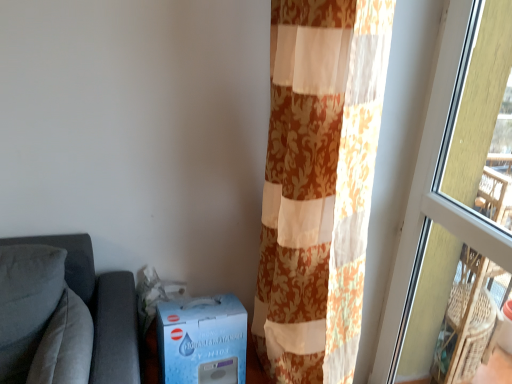
Question: Can you confirm if blue cardboard box at lower left is positioned to the left of floral fabric curtain at right?

Choices:
 (A) no
 (B) yes

Answer: (B)

Question: Does blue cardboard box at lower left have a smaller size compared to floral fabric curtain at right?

Choices:
 (A) no
 (B) yes

Answer: (B)

Question: Is blue cardboard box at lower left surrounding floral fabric curtain at right?

Choices:
 (A) no
 (B) yes

Answer: (A)

Question: Can you confirm if blue cardboard box at lower left is bigger than floral fabric curtain at right?

Choices:
 (A) yes
 (B) no

Answer: (B)

Question: Can you confirm if blue cardboard box at lower left is taller than floral fabric curtain at right?

Choices:
 (A) no
 (B) yes

Answer: (A)

Question: From the image's perspective, is floral fabric curtain at right positioned above or below suede-like gray pillow at left?

Choices:
 (A) below
 (B) above

Answer: (B)

Question: Considering their positions, is floral fabric curtain at right located in front of or behind suede-like gray pillow at left?

Choices:
 (A) front
 (B) behind

Answer: (A)

Question: Is floral fabric curtain at right situated inside suede-like gray pillow at left or outside?

Choices:
 (A) outside
 (B) inside

Answer: (A)

Question: Is point (327, 26) positioned closer to the camera than point (81, 332)?

Choices:
 (A) closer
 (B) farther

Answer: (A)

Question: Is blue cardboard box at lower left in front of or behind transparent glass window at right in the image?

Choices:
 (A) front
 (B) behind

Answer: (B)

Question: Is blue cardboard box at lower left inside the boundaries of transparent glass window at right, or outside?

Choices:
 (A) inside
 (B) outside

Answer: (B)

Question: In terms of size, does blue cardboard box at lower left appear bigger or smaller than transparent glass window at right?

Choices:
 (A) big
 (B) small

Answer: (B)

Question: From a real-world perspective, is blue cardboard box at lower left physically located above or below transparent glass window at right?

Choices:
 (A) below
 (B) above

Answer: (A)

Question: From the image's perspective, is blue cardboard box at lower left located above or below floral fabric curtain at right?

Choices:
 (A) below
 (B) above

Answer: (A)

Question: Is blue cardboard box at lower left situated inside floral fabric curtain at right or outside?

Choices:
 (A) inside
 (B) outside

Answer: (B)